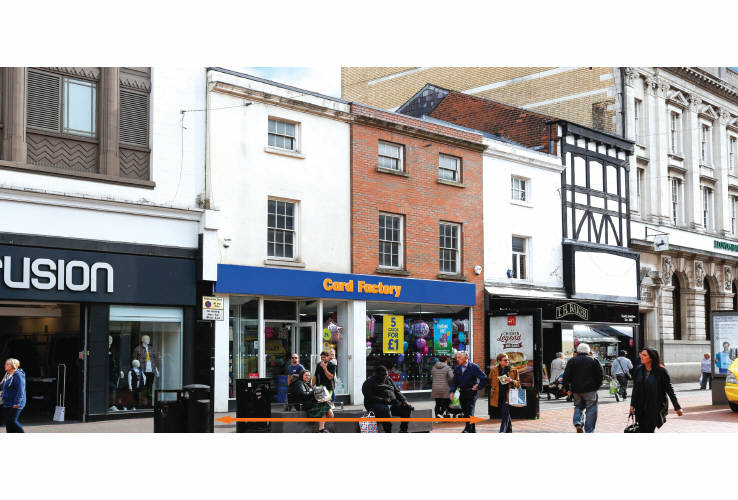
Where is `mannequin`? Image resolution: width=738 pixels, height=500 pixels. mannequin is located at coordinates (131, 376), (139, 358).